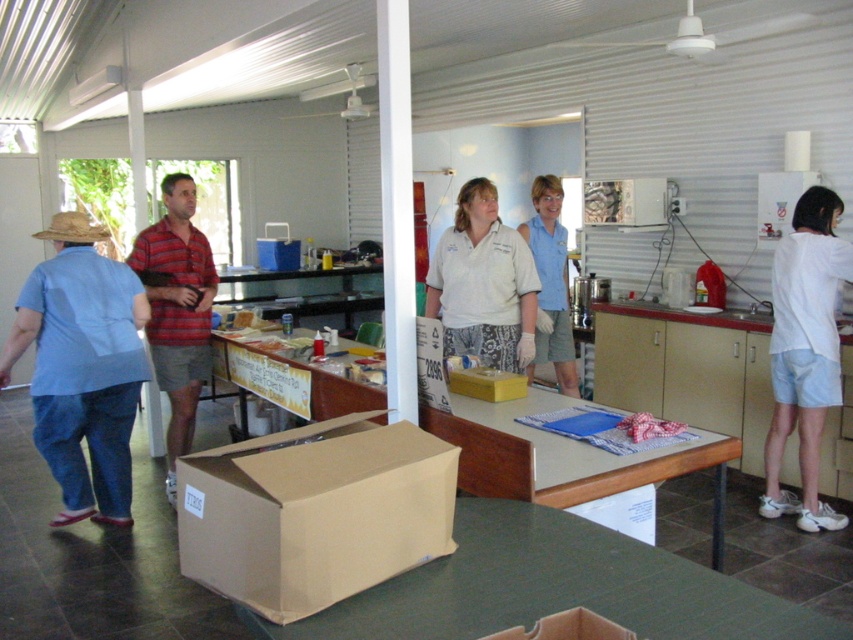
Does blue cotton shirt at center have a greater height compared to yellow cardboard box at center?

Correct, blue cotton shirt at center is much taller as yellow cardboard box at center.

Does point (538, 262) come behind point (460, 372)?

That is True.

Consider the image. Measure the distance between point [552,317] and camera.

Point [552,317] is 4.61 meters away from camera.

Identify the location of blue cotton shirt at center. (550, 282).

In the scene shown: Does brown cardboard box at center have a lesser width compared to blue cotton shirt at center?

No, brown cardboard box at center is not thinner than blue cotton shirt at center.

Looking at this image, between brown cardboard box at center and blue cotton shirt at center, which one has less height?

brown cardboard box at center is shorter.

Where is `brown cardboard box at center`? This screenshot has width=853, height=640. brown cardboard box at center is located at coordinates (314, 513).

Can you confirm if white cotton shirt at center is bigger than yellow cardboard box at center?

Indeed, white cotton shirt at center has a larger size compared to yellow cardboard box at center.

Who is more distant from viewer, (485, 243) or (506, 374)?

Positioned behind is point (485, 243).

Find the location of a particular element. white cotton shirt at center is located at coordinates (483, 284).